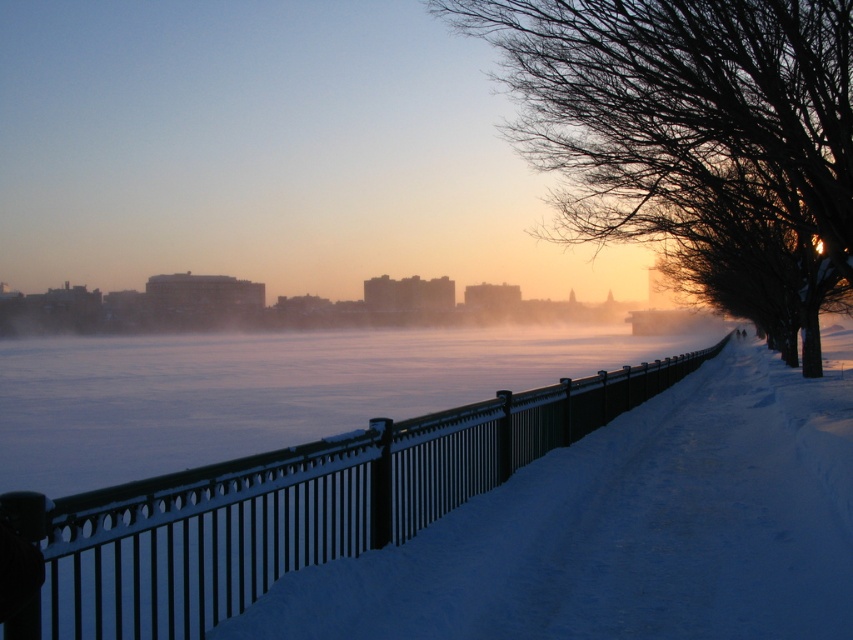
You are standing at the camera position and want to reach the bare branches at upper right. The path is 10 meters long. Can you walk straight along the path to reach them?

The bare branches at upper right are 11.92 meters away from the camera, which is longer than the 10 meters path. Therefore, you cannot reach them by walking straight along the path.

You are an artist planning to paint the winter scene. You want to ensure the bare branches at upper right and the black metal fence at center are proportionally accurate. Which object should you draw wider in your painting?

The bare branches at upper right should be drawn wider than the black metal fence at center because their width is larger according to the description.